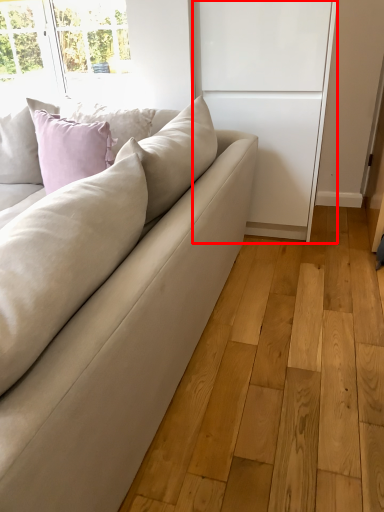
Question: From the image's perspective, considering the relative positions of screen door (annotated by the red box) and studio couch in the image provided, where is screen door (annotated by the red box) located with respect to the staircase?

Choices:
 (A) above
 (B) below

Answer: (A)